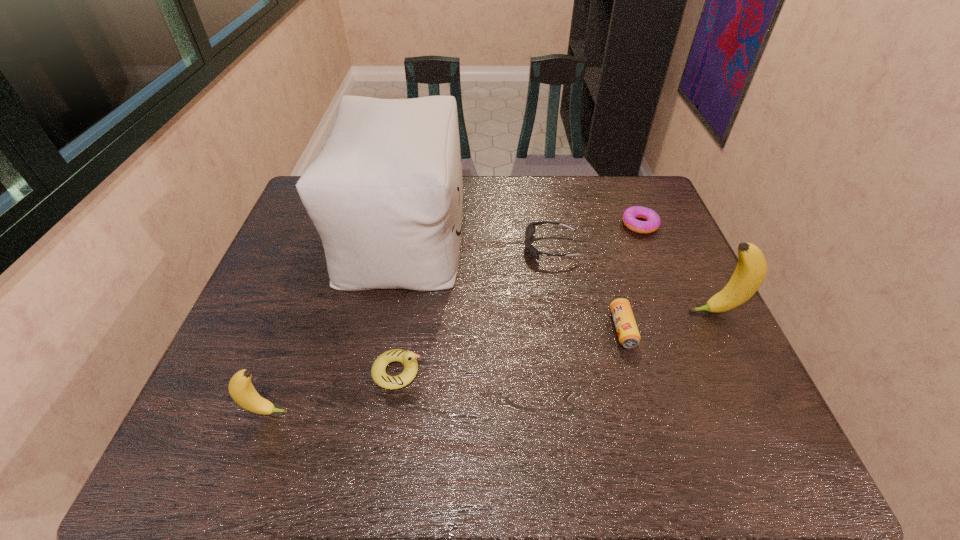
If the aim is uniform spacing by inserting an additional banana among them, please point to a vacant space for this new banana. Please provide its 2D coordinates. Your answer should be formatted as a tuple, i.e. [(x, y)], where the tuple contains the x and y coordinates of a point satisfying the conditions above.

[(513, 357)]